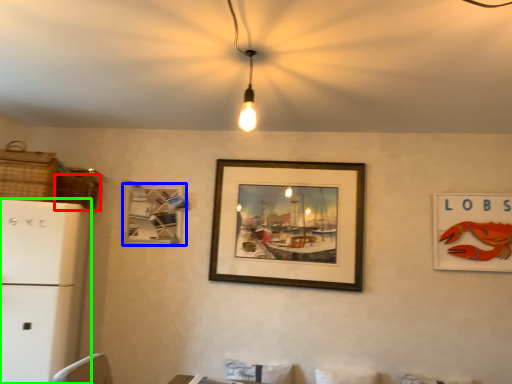
Question: Based on their relative distances, which object is farther from basket (highlighted by a red box)? Choose from picture frame (highlighted by a blue box) and fridge (highlighted by a green box).

Choices:
 (A) picture frame
 (B) fridge

Answer: (B)